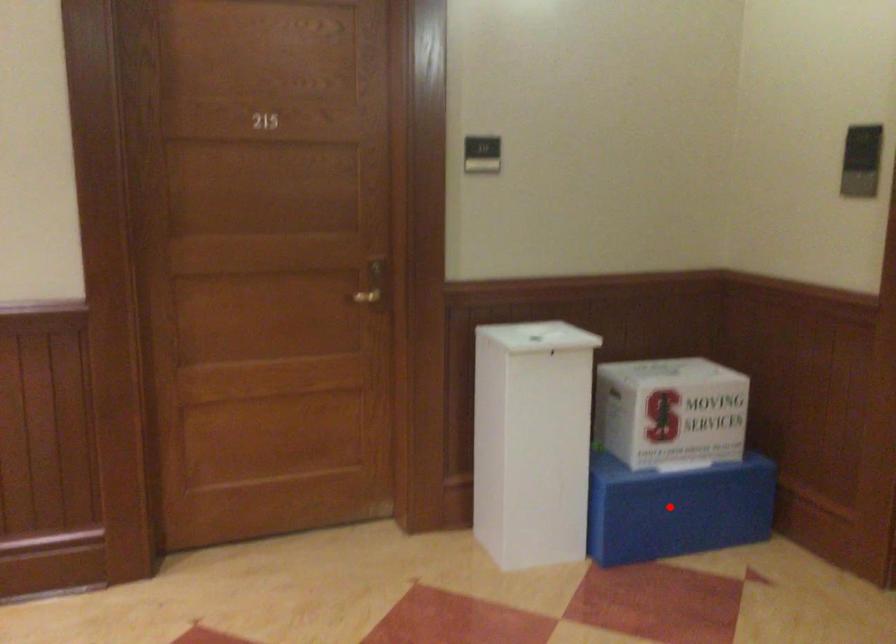
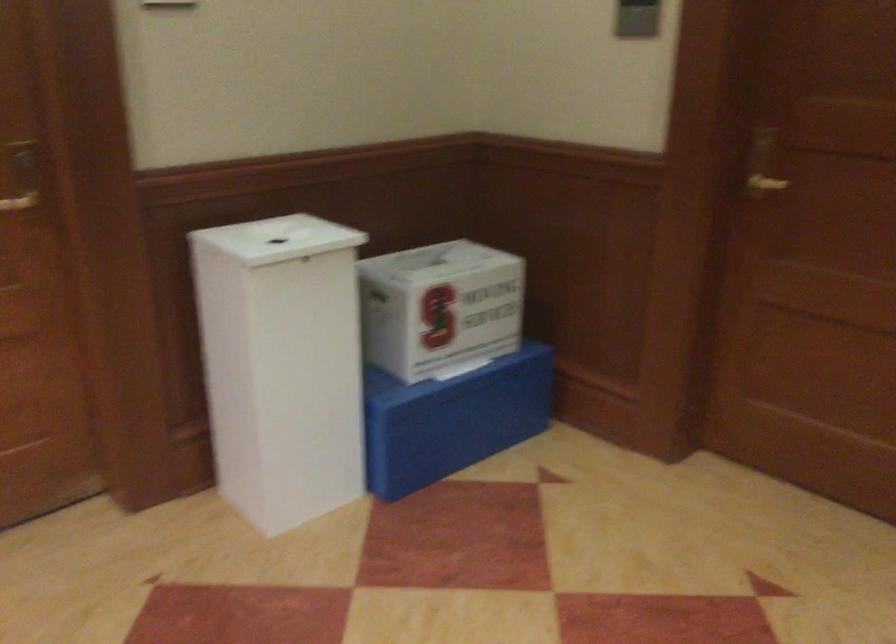
Find the pixel in the second image that matches the highlighted location in the first image.

(452, 419)